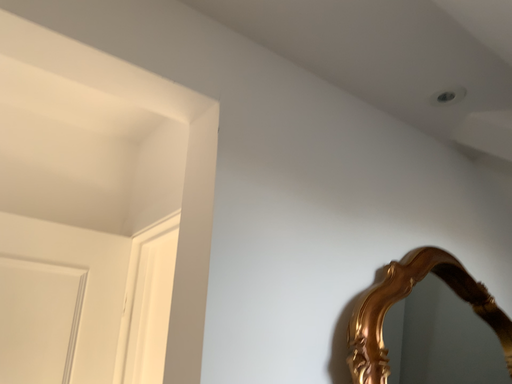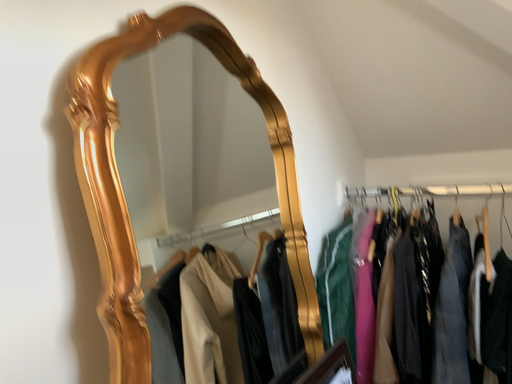
Question: Which way did the camera rotate in the video?

Choices:
 (A) rotated left
 (B) rotated right

Answer: (B)